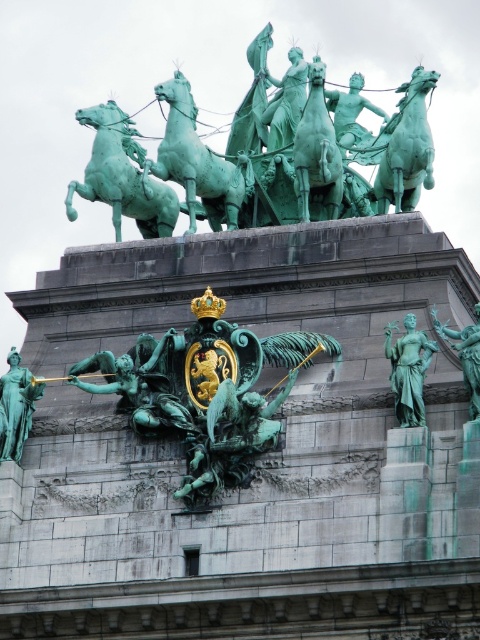
You are an architect designing a new plaza and want to replicate the distance between the green patina chariot at upper center and the green patinated metal emblem at center from the image. What is the exact distance in meters you should maintain between these two elements?

The exact distance you should maintain between the green patina chariot at upper center and the green patinated metal emblem at center is 21.04 meters, as specified in the description.

You are an architect analyzing the symmetry of the monument. You notice a point at coordinates [269,156]. What object is located at this point?

The point at coordinates [269,156] marks the green patina chariot at upper center.